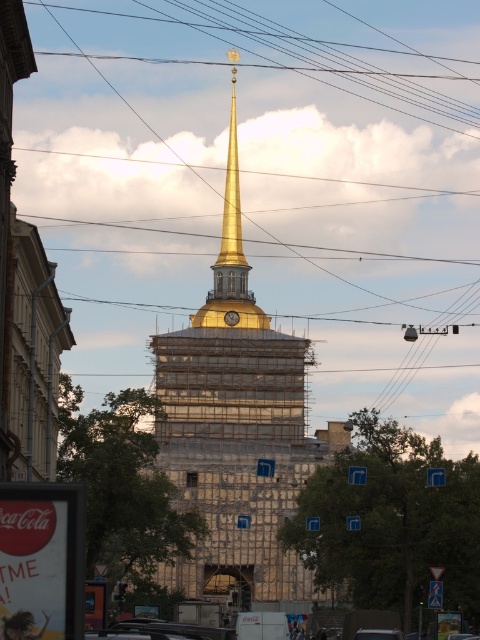
You are a city planner assessing the construction site. You need to determine if the gold metallic spire at center will block the view of the metallic wire at upper center from the main road. Can you confirm if the spire is taller than the wire?

The gold metallic spire at center is taller than the metallic wire at upper center, so yes, the spire will block the view of the metallic wire at upper center from the main road.

You are an architect examining the construction site. You notice the gold metallic spire at center and the metallic wire at upper center. Which object is bigger in size?

The gold metallic spire at center is larger in size than the metallic wire at upper center.

From the picture: You are standing at the base of the under construction building with a tall golden spire. You notice a point marked at coordinates (205, 481). If you want to reach that point quickly, should you walk towards the building or away from it?

The point at (205, 481) is 695.41 feet away from you. Since this distance is quite far, you should walk towards the building to reach the point more quickly.